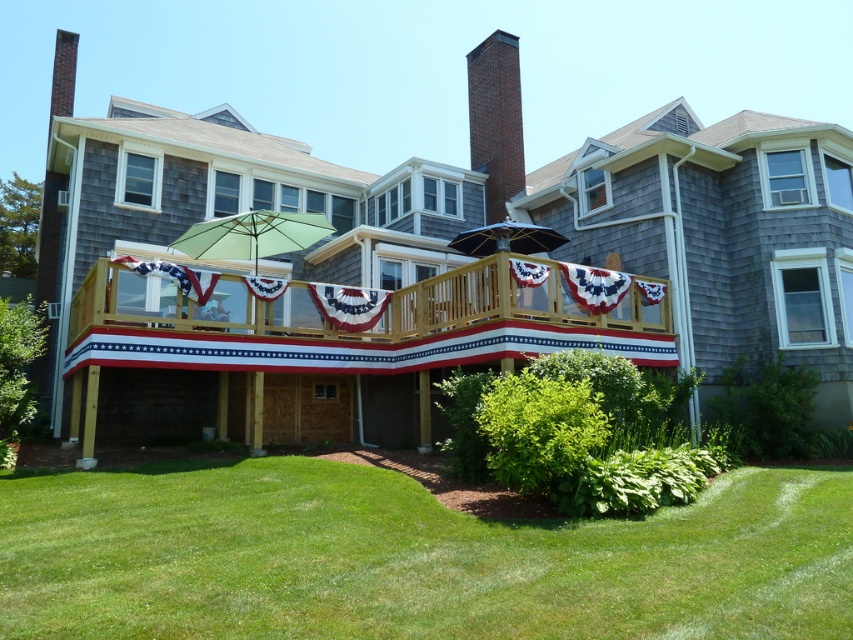
Question: Can you confirm if brick chimney at center is wider than yellow fabric umbrella at center?

Choices:
 (A) yes
 (B) no

Answer: (B)

Question: Which object is farther from the camera taking this photo?

Choices:
 (A) yellow fabric umbrella at center
 (B) brick chimney at center
 (C) green grass at lower center
 (D) wooden deck at center

Answer: (B)

Question: Which of the following is the closest to the observer?

Choices:
 (A) (563, 241)
 (B) (511, 108)
 (C) (254, 227)
 (D) (289, 456)

Answer: (D)

Question: Which point appears farthest from the camera in this image?

Choices:
 (A) (695, 561)
 (B) (509, 224)
 (C) (184, 404)
 (D) (479, 68)

Answer: (D)

Question: Is green grass at lower center positioned in front of green fabric umbrella at center?

Choices:
 (A) yes
 (B) no

Answer: (A)

Question: Can you confirm if green fabric umbrella at center is bigger than yellow fabric umbrella at center?

Choices:
 (A) yes
 (B) no

Answer: (A)